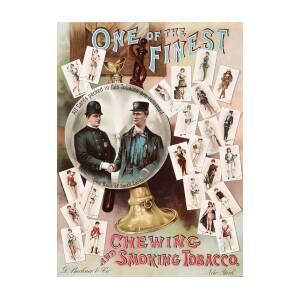
Image resolution: width=300 pixels, height=300 pixels. I want to click on art, so click(x=111, y=217).